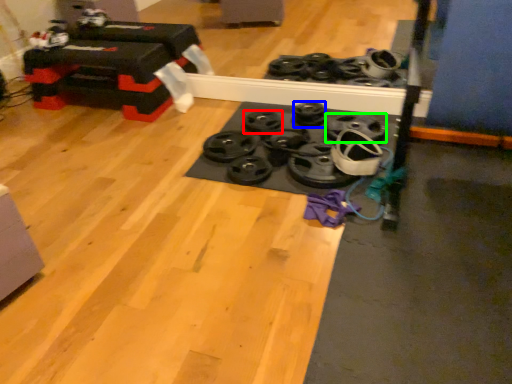
Question: Which object is the farthest from wheel (highlighted by a red box)? Choose among these: wheel (highlighted by a blue box) or wheel (highlighted by a green box).

Choices:
 (A) wheel
 (B) wheel

Answer: (B)